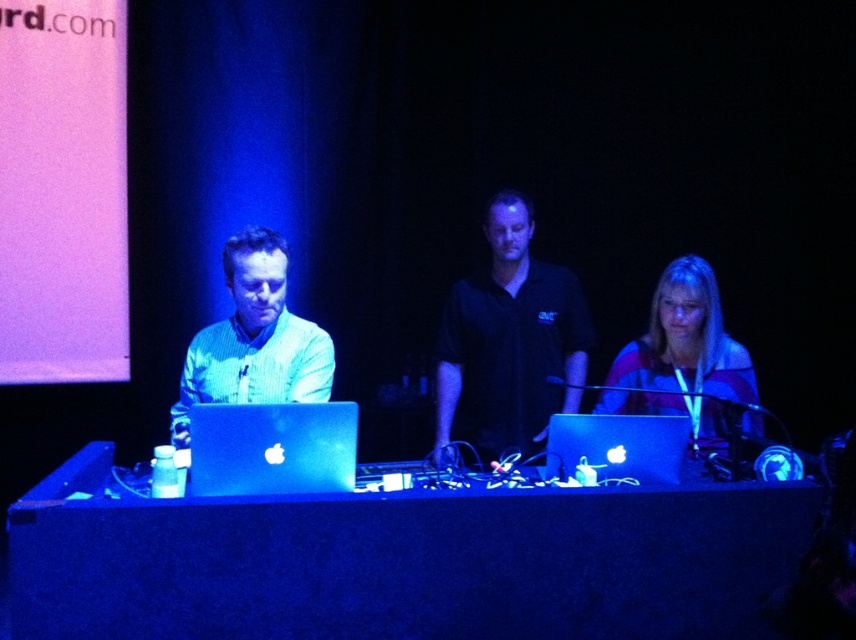
You are an event photographer at the stage. You need to take a photo of the green matte shirt at center. Where should you point your camera to capture it?

You should point your camera to the coordinates point at (254, 339) to capture the green matte shirt at center.

You are an event photographer at the stage. You need to capture a clear photo of the green matte shirt at center and the sleek silver laptop at center. Which object should you focus on first if you want to ensure both are in sharp focus?

The green matte shirt at center is much taller than the sleek silver laptop at center, so you should focus on the green matte shirt at center first to ensure both are in sharp focus.